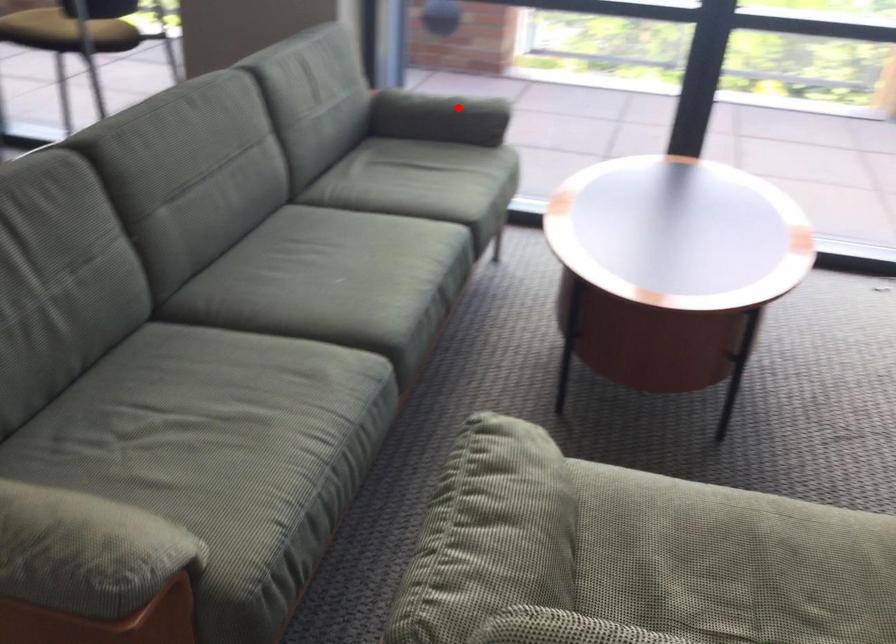
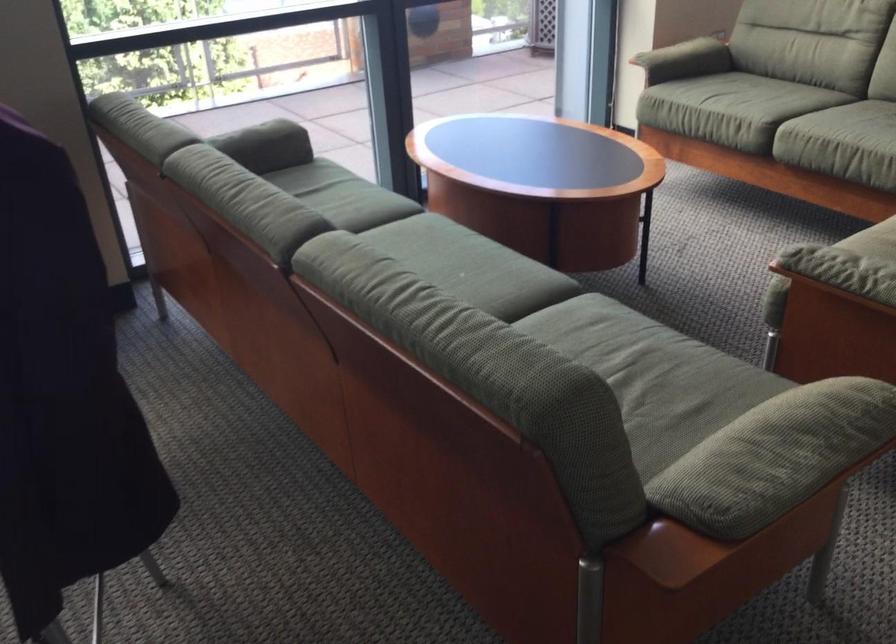
In the second image, find the point that corresponds to the highlighted location in the first image.

(265, 140)